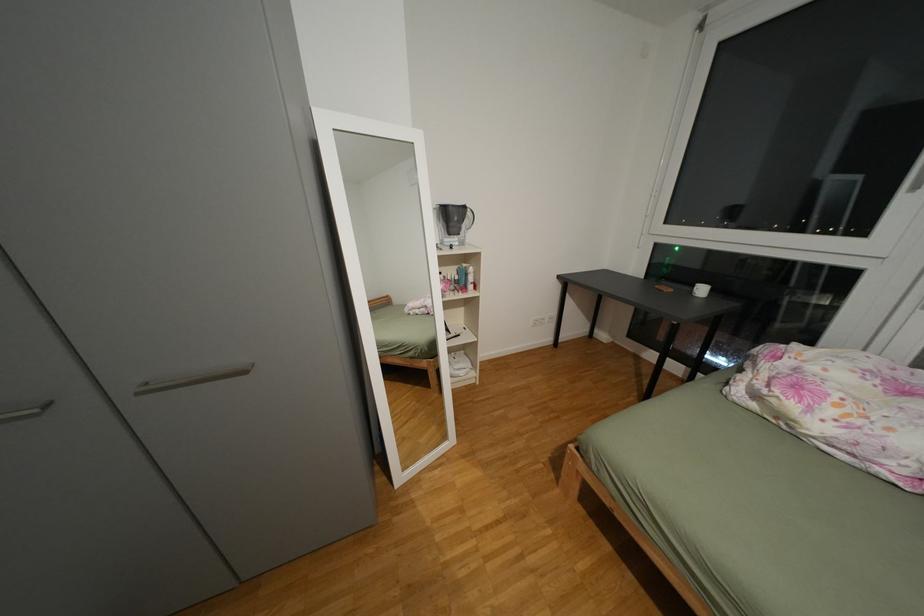
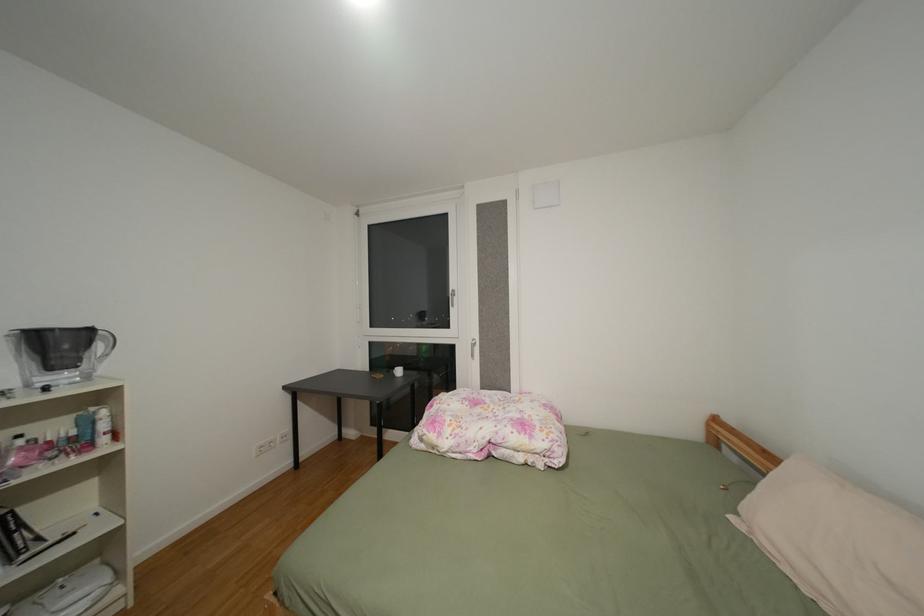
Question: The camera is either moving clockwise (left) or counter-clockwise (right) around the object. The first image is from the beginning of the video and the second image is from the end. Is the camera moving left or right when shooting the video?

Choices:
 (A) Left
 (B) Right

Answer: (A)